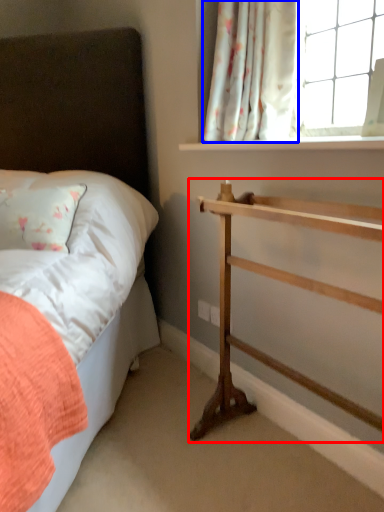
Question: Among these objects, which one is farthest to the camera, shelf (highlighted by a red box) or curtain (highlighted by a blue box)?

Choices:
 (A) shelf
 (B) curtain

Answer: (B)